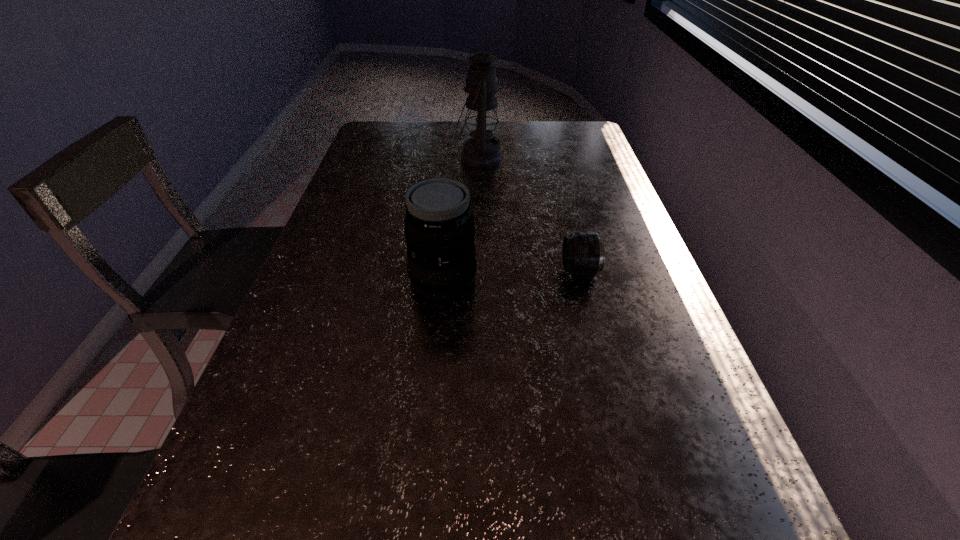
What are the coordinates of `vacant region located 0.220m at the front element of the shortest object` in the screenshot? It's located at (472, 271).

This screenshot has height=540, width=960. I want to click on object that is at the far edge, so click(482, 150).

Where is `object situated at the right edge`? The image size is (960, 540). object situated at the right edge is located at coordinates (583, 254).

Locate an element on the screen. The width and height of the screenshot is (960, 540). vacant space at the far edge of the desktop is located at coordinates (444, 124).

What are the coordinates of `blank space at the left edge of the desktop` in the screenshot? It's located at (352, 232).

At what (x,y) coordinates should I click in order to perform the action: click on vacant region at the right edge of the desktop. Please return your answer as a coordinate pair (x, y). Looking at the image, I should click on (591, 222).

I want to click on free space at the far left corner, so click(382, 123).

Locate an element on the screen. vacant position at the far right corner of the desktop is located at coordinates (599, 146).

Image resolution: width=960 pixels, height=540 pixels. I want to click on vacant space that's between the right telephoto lens and the farthest object, so click(x=530, y=214).

I want to click on vacant area between the farthest object and the rightmost object, so click(x=530, y=214).